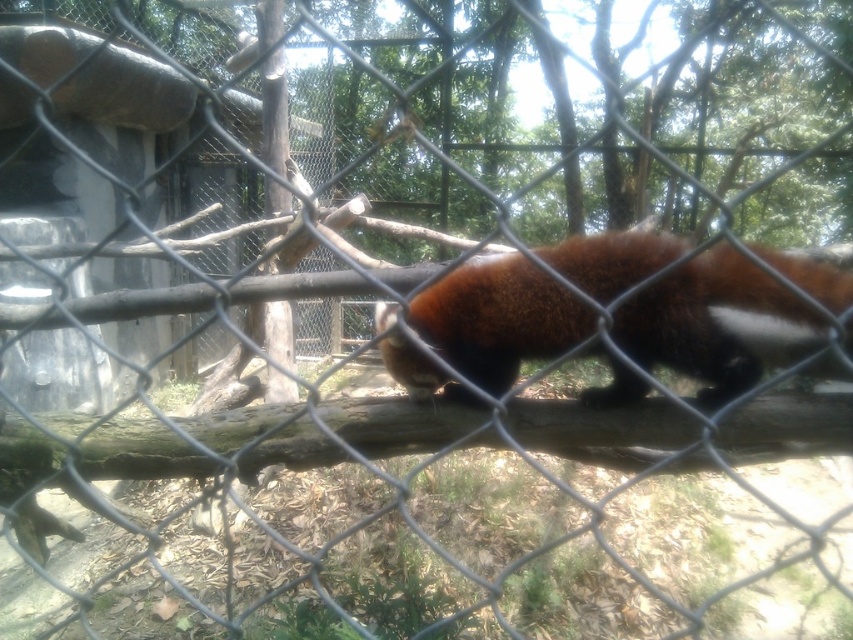
Is fuzzy brown fur at center below brown rough wood at center?

Actually, fuzzy brown fur at center is above brown rough wood at center.

Is point (619, 260) less distant than point (791, 396)?

No, (619, 260) is further to viewer.

Locate an element on the screen. This screenshot has height=640, width=853. fuzzy brown fur at center is located at coordinates (717, 323).